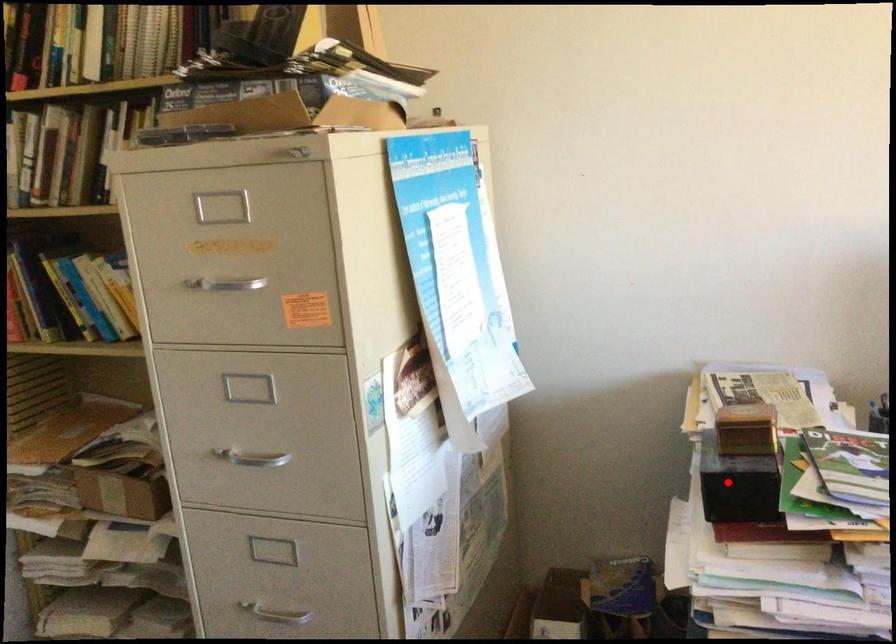
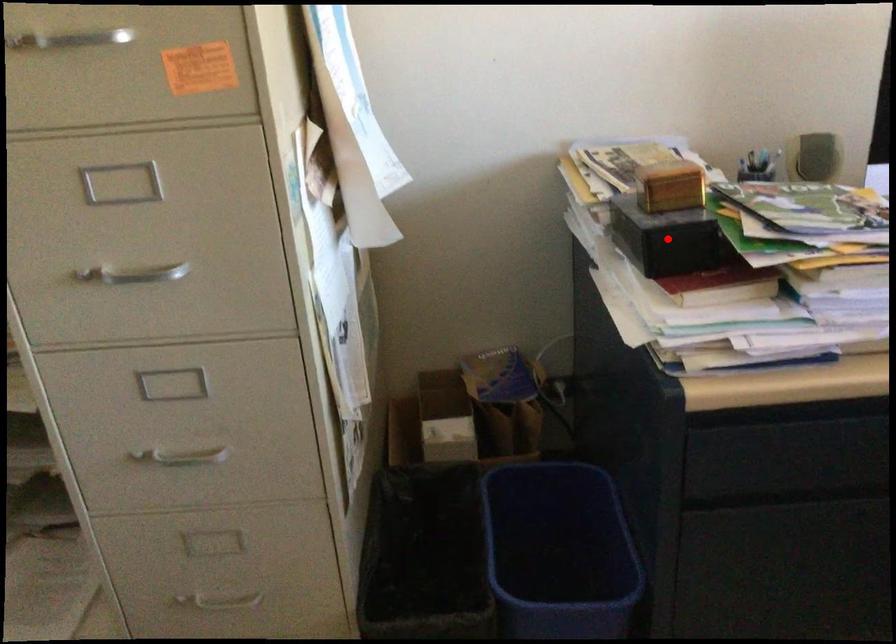
I am providing you with two images of the same scene from different viewpoints. A red point is marked on the first image and another point is marked on the second image. Do the highlighted points in image1 and image2 indicate the same real-world spot?

Yes